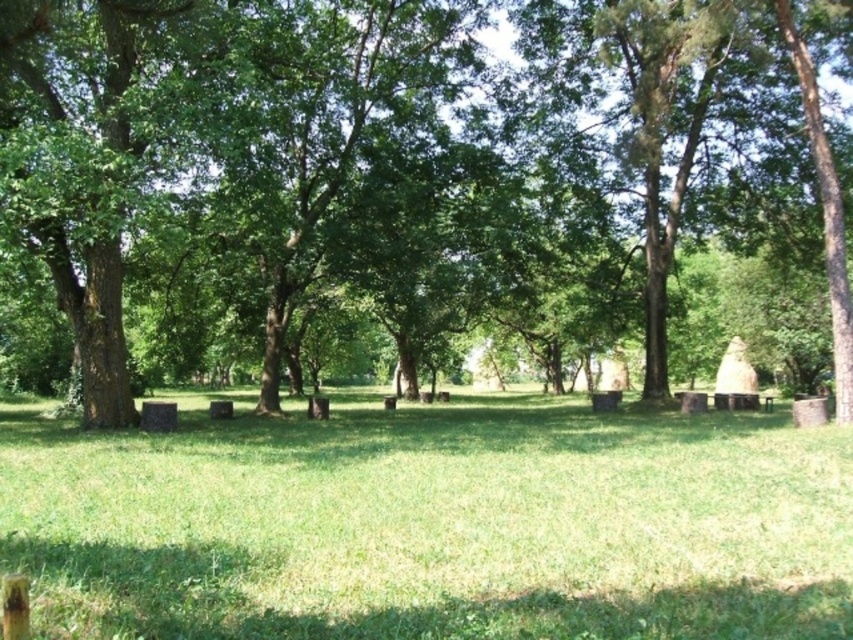
Question: Can you confirm if brown rough tree at center is wider than green grassy field at center?

Choices:
 (A) no
 (B) yes

Answer: (B)

Question: Is brown rough tree at center positioned at the back of green grassy field at center?

Choices:
 (A) no
 (B) yes

Answer: (B)

Question: Which of the following is the farthest from the observer?

Choices:
 (A) (x=738, y=628)
 (B) (x=337, y=90)

Answer: (B)

Question: Does brown rough tree at center have a larger size compared to green grassy field at center?

Choices:
 (A) no
 (B) yes

Answer: (B)